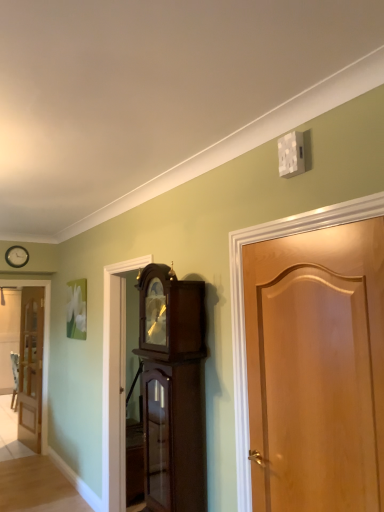
You are a GUI agent. You are given a task and a screenshot of the screen. Output one action in this format:
    pyautogui.click(x=<x>, y=<y>)
    Task: Click on the blank space situated above light brown wood door at right, the second door viewed from the left (from a real-world perspective)
    This screenshot has width=384, height=512.
    Given the screenshot: What is the action you would take?
    pyautogui.click(x=306, y=233)